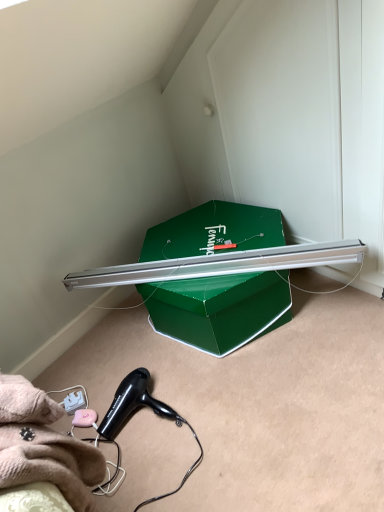
Locate an element on the screen. This screenshot has height=512, width=384. free space in front of green cardboard box at center is located at coordinates (277, 407).